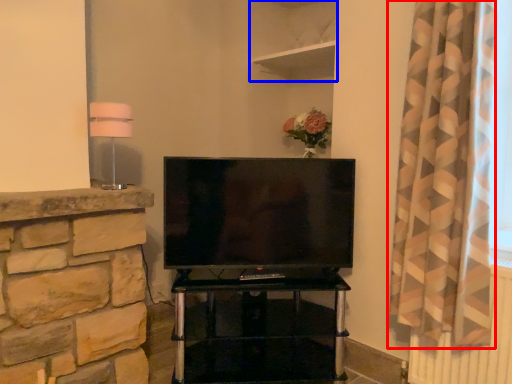
Question: Which object appears farthest to the camera in this image, curtain (highlighted by a red box) or shelf (highlighted by a blue box)?

Choices:
 (A) curtain
 (B) shelf

Answer: (B)